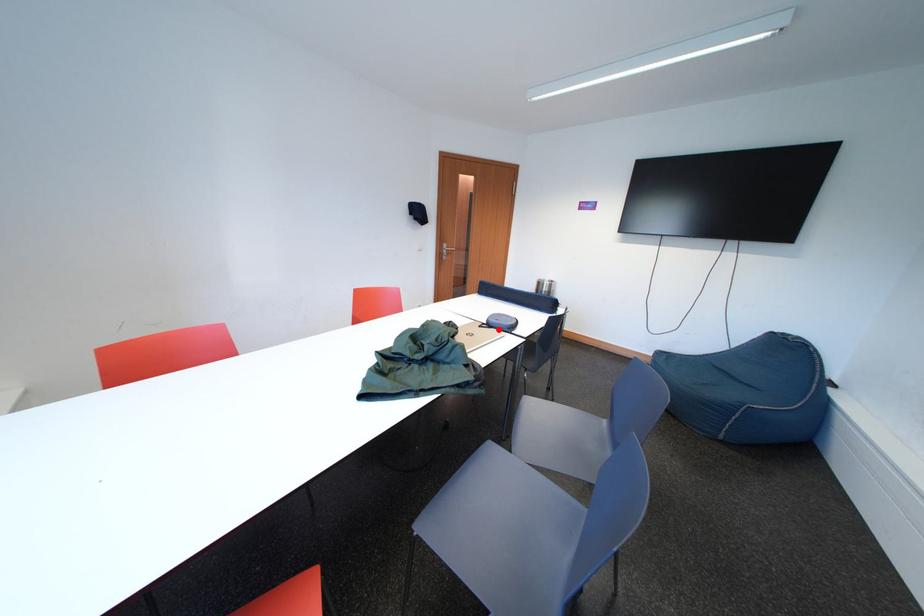
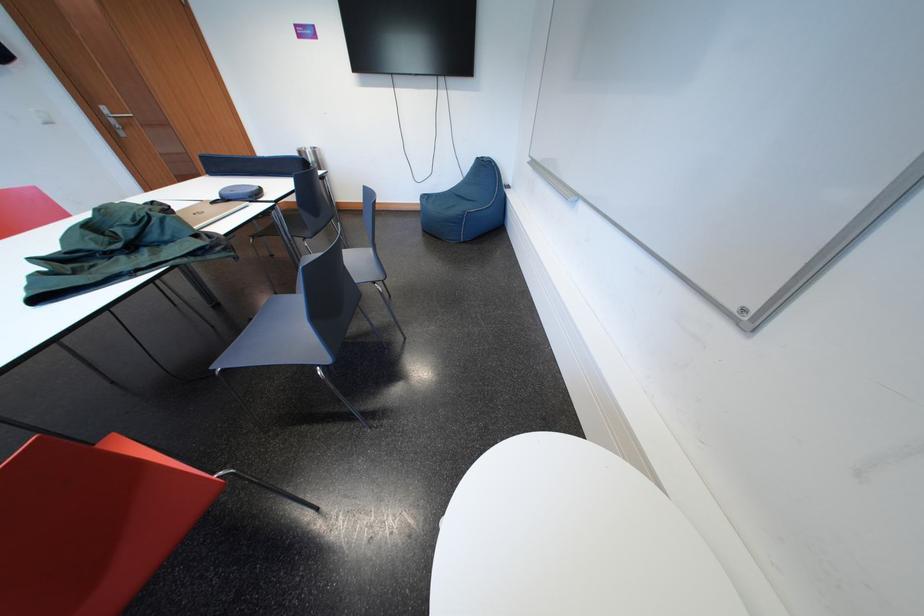
Where in the second image is the point corresponding to the highlighted location from the first image?

(235, 204)